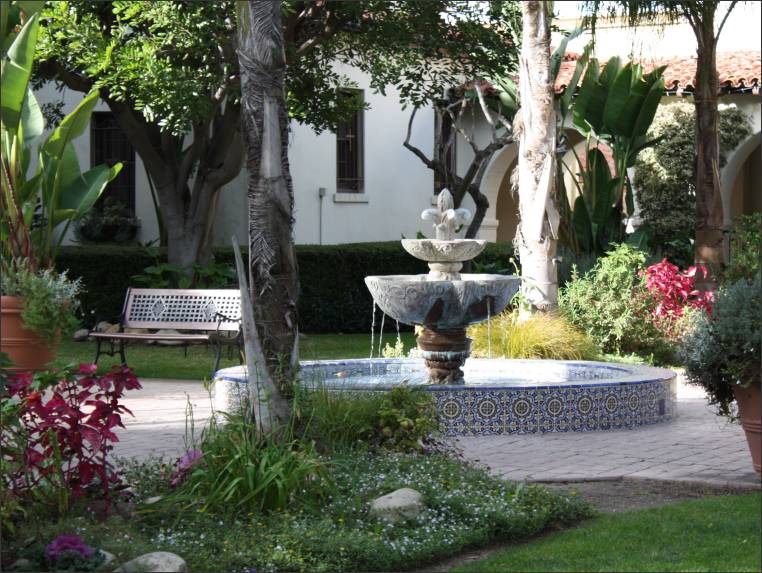
In order to click on bench in this screenshot , I will do `click(180, 317)`.